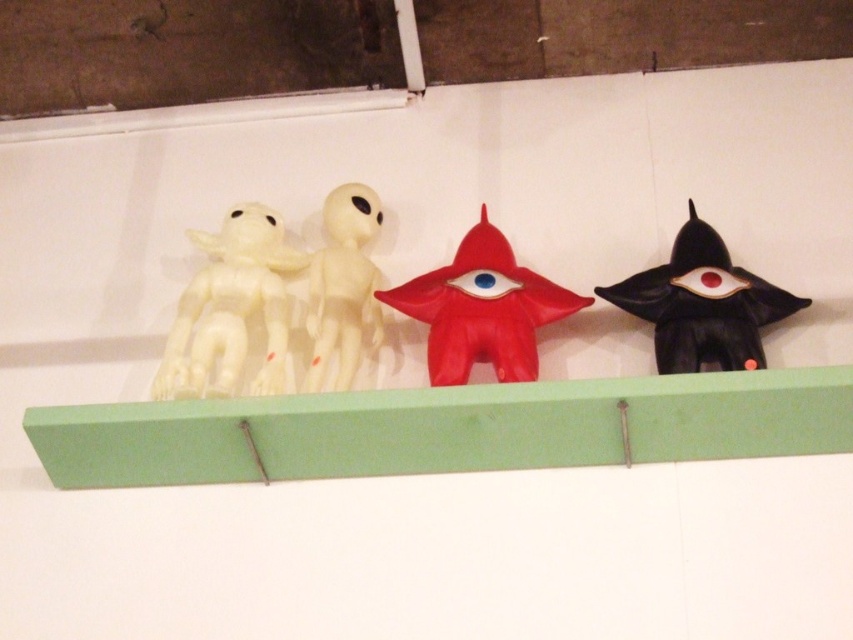
Question: Does white matte toy at left lie behind black matte alien at right?

Choices:
 (A) yes
 (B) no

Answer: (A)

Question: Can you confirm if white matte toy at left is thinner than black matte alien at right?

Choices:
 (A) yes
 (B) no

Answer: (A)

Question: Is green wood at center wider than red matte alien at center?

Choices:
 (A) no
 (B) yes

Answer: (B)

Question: Estimate the real-world distances between objects in this image. Which object is closer to the red matte alien at center?

Choices:
 (A) green wood at center
 (B) white matte alien at center
 (C) black matte alien at right
 (D) white matte toy at left

Answer: (B)

Question: Which of the following is the farthest from the observer?

Choices:
 (A) white matte toy at left
 (B) red matte alien at center
 (C) white matte alien at center

Answer: (C)

Question: Which of the following is the closest to the observer?

Choices:
 (A) black matte alien at right
 (B) red matte alien at center
 (C) white matte alien at center
 (D) green wood at center

Answer: (D)